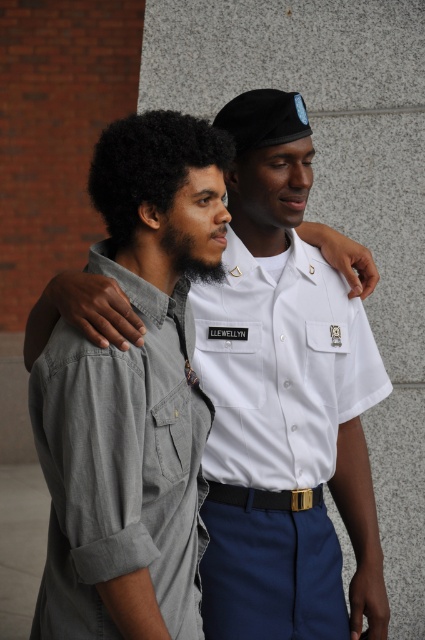
Identify the location of white uniform shirt at center. (285, 401).

Looking at this image, does white uniform shirt at center have a greater width compared to black leather belt at center?

Yes.

Measure the distance between point (x=357, y=321) and camera.

Point (x=357, y=321) is 10.54 feet away from camera.

Identify the location of white uniform shirt at center. The width and height of the screenshot is (425, 640). (285, 401).

Who is more forward, (223,154) or (263,504)?

Point (223,154) is in front.

Does dark curly hair at center appear on the right side of black leather belt at center?

Incorrect, dark curly hair at center is not on the right side of black leather belt at center.

Where is `dark curly hair at center`? The image size is (425, 640). dark curly hair at center is located at coordinates (150, 164).

Does white smooth shirt at center have a larger size compared to white cotton shirt at left?

No, white smooth shirt at center is not bigger than white cotton shirt at left.

Who is more forward, (317, 273) or (170, 472)?

Point (170, 472) is more forward.

Is point (229, 564) closer to viewer compared to point (155, 336)?

No, it is not.

The height and width of the screenshot is (640, 425). I want to click on white smooth shirt at center, so click(x=280, y=365).